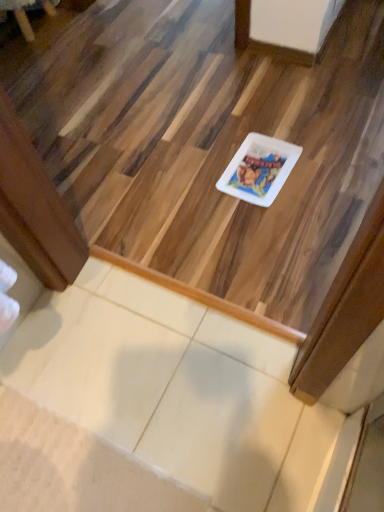
This screenshot has width=384, height=512. Describe the element at coordinates (19, 15) in the screenshot. I see `brushed metal table at upper left` at that location.

Locate an element on the screen. The height and width of the screenshot is (512, 384). brushed metal table at upper left is located at coordinates (19, 15).

At what (x,y) coordinates should I click in order to perform the action: click on brushed metal table at upper left. Please return your answer as a coordinate pair (x, y). The image size is (384, 512). Looking at the image, I should click on (19, 15).

From a real-world perspective, between white glossy plate at center and white glossy plate at center, who is vertically higher?

In real-world perspective, white glossy plate at center is above.

Is white glossy plate at center bigger than white glossy plate at center?

No.

From the image's perspective, between white glossy plate at center and white glossy plate at center, which one is located above?

white glossy plate at center, from the image's perspective.

Which object is positioned more to the right, white glossy plate at center or white glossy plate at center?

From the viewer's perspective, white glossy plate at center appears more on the right side.

From the image's perspective, which is below, white glossy plate at center or brushed metal table at upper left?

white glossy plate at center appears lower in the image.

Considering the positions of objects white glossy plate at center and brushed metal table at upper left in the image provided, who is more to the right, white glossy plate at center or brushed metal table at upper left?

Positioned to the right is white glossy plate at center.

Considering the positions of point (172, 88) and point (46, 13), is point (172, 88) closer or farther from the camera than point (46, 13)?

Clearly, point (172, 88) is closer to the camera than point (46, 13).

Which is correct: white glossy plate at center is inside brushed metal table at upper left, or outside of it?

A: white glossy plate at center is located beyond the bounds of brushed metal table at upper left.

Is white glossy plate at center facing away from brushed metal table at upper left?

white glossy plate at center does not have its back to brushed metal table at upper left.

Are white glossy plate at center and brushed metal table at upper left far apart?

That's not correct — white glossy plate at center is a little close to brushed metal table at upper left.

Which of these two, brushed metal table at upper left or white glossy plate at center, is wider?

With larger width is white glossy plate at center.

Relative to white glossy plate at center, is brushed metal table at upper left in front or behind?

In the image, brushed metal table at upper left appears behind white glossy plate at center.

In the image, is brushed metal table at upper left positioned in front of or behind white glossy plate at center?

brushed metal table at upper left is positioned farther from the viewer than white glossy plate at center.

Is brushed metal table at upper left touching white glossy plate at center?

No, brushed metal table at upper left is not in contact with white glossy plate at center.

Who is bigger, brushed metal table at upper left or white glossy plate at center?

brushed metal table at upper left.

Is brushed metal table at upper left spatially inside white glossy plate at center, or outside of it?

brushed metal table at upper left exists outside the volume of white glossy plate at center.

Can you tell me how much white glossy plate at center and white glossy plate at center differ in facing direction?

The facing directions of white glossy plate at center and white glossy plate at center are 179 degrees apart.

The width and height of the screenshot is (384, 512). In order to click on glass plate behind the white glossy plate at center in this screenshot , I will do `click(259, 169)`.

Is white glossy plate at center behind white glossy plate at center?

No, white glossy plate at center is closer to the viewer.

Is white glossy plate at center aimed at white glossy plate at center?

No.

The height and width of the screenshot is (512, 384). I want to click on stairwell in front of the white glossy plate at center, so click(x=205, y=143).

Locate an element on the screen. furniture on the left of the white glossy plate at center is located at coordinates (19, 15).

Which object lies further to the anchor point white glossy plate at center, brushed metal table at upper left or white glossy plate at center?

Among the two, brushed metal table at upper left is located further to white glossy plate at center.

From the image, which object appears to be nearer to brushed metal table at upper left, white glossy plate at center or white glossy plate at center?

white glossy plate at center.

Based on their spatial positions, is brushed metal table at upper left or white glossy plate at center further from white glossy plate at center?

brushed metal table at upper left.

Considering their positions, is white glossy plate at center positioned closer to white glossy plate at center than brushed metal table at upper left?

white glossy plate at center is positioned closer to the anchor white glossy plate at center.

Estimate the real-world distances between objects in this image. Which object is further from white glossy plate at center, white glossy plate at center or brushed metal table at upper left?

brushed metal table at upper left.

Considering their positions, is white glossy plate at center positioned further to brushed metal table at upper left than white glossy plate at center?

white glossy plate at center lies further to brushed metal table at upper left than the other object.

The width and height of the screenshot is (384, 512). In order to click on stairwell between brushed metal table at upper left and white glossy plate at center in the horizontal direction in this screenshot , I will do `click(205, 143)`.